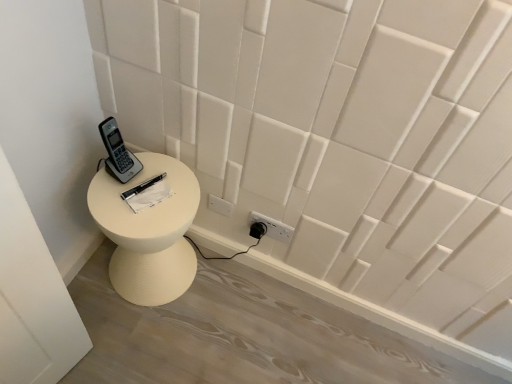
This screenshot has height=384, width=512. In order to click on free spot to the left of white paper at center in this screenshot , I will do `click(112, 189)`.